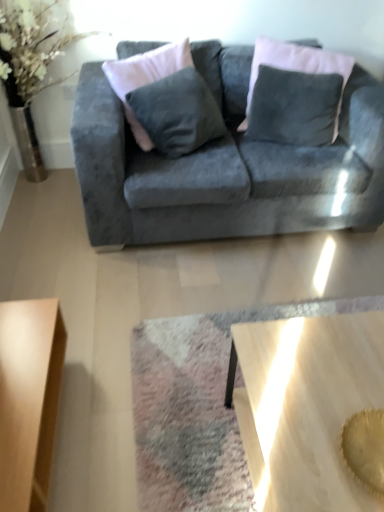
Question: Is wooden polished coffee table at lower center, which is the 1th coffee table from right to left, located within velvet gray couch at center?

Choices:
 (A) no
 (B) yes

Answer: (A)

Question: Can you confirm if velvet gray couch at center is positioned to the left of wooden polished coffee table at lower center, arranged as the second coffee table when viewed from the left?

Choices:
 (A) yes
 (B) no

Answer: (A)

Question: Does velvet gray couch at center appear on the right side of wooden polished coffee table at lower center, arranged as the second coffee table when viewed from the left?

Choices:
 (A) no
 (B) yes

Answer: (A)

Question: Is velvet gray couch at center looking in the opposite direction of wooden polished coffee table at lower center, which is the 1th coffee table from right to left?

Choices:
 (A) yes
 (B) no

Answer: (B)

Question: Considering the relative sizes of velvet gray couch at center and wooden polished coffee table at lower center, arranged as the second coffee table when viewed from the left, in the image provided, is velvet gray couch at center wider than wooden polished coffee table at lower center, arranged as the second coffee table when viewed from the left,?

Choices:
 (A) no
 (B) yes

Answer: (B)

Question: From the image's perspective, is light brown wooden coffee table at lower left, the first coffee table viewed from the left, positioned above or below velvet dark gray pillow at upper center?

Choices:
 (A) above
 (B) below

Answer: (B)

Question: Relative to velvet dark gray pillow at upper center, is light brown wooden coffee table at lower left, which ranks as the 2th coffee table in right-to-left order, in front or behind?

Choices:
 (A) behind
 (B) front

Answer: (B)

Question: Does point (52, 389) appear closer or farther from the camera than point (256, 54)?

Choices:
 (A) closer
 (B) farther

Answer: (A)

Question: From a real-world perspective, is light brown wooden coffee table at lower left, which ranks as the 2th coffee table in right-to-left order, positioned above or below velvet dark gray pillow at upper center?

Choices:
 (A) below
 (B) above

Answer: (A)

Question: In terms of width, does light brown wooden coffee table at lower left, which ranks as the 2th coffee table in right-to-left order, look wider or thinner when compared to velvet gray couch at center?

Choices:
 (A) thin
 (B) wide

Answer: (A)

Question: Is light brown wooden coffee table at lower left, which ranks as the 2th coffee table in right-to-left order, situated inside velvet gray couch at center or outside?

Choices:
 (A) outside
 (B) inside

Answer: (A)

Question: Considering the positions of point (3, 407) and point (117, 201), is point (3, 407) closer or farther from the camera than point (117, 201)?

Choices:
 (A) farther
 (B) closer

Answer: (B)

Question: From a real-world perspective, is light brown wooden coffee table at lower left, the first coffee table viewed from the left, physically located above or below velvet gray couch at center?

Choices:
 (A) above
 (B) below

Answer: (B)

Question: From the image's perspective, relative to wooden polished coffee table at lower center, arranged as the second coffee table when viewed from the left, is light brown wooden coffee table at lower left, the first coffee table viewed from the left, above or below?

Choices:
 (A) above
 (B) below

Answer: (A)

Question: Relative to wooden polished coffee table at lower center, arranged as the second coffee table when viewed from the left, is light brown wooden coffee table at lower left, the first coffee table viewed from the left, in front or behind?

Choices:
 (A) front
 (B) behind

Answer: (B)